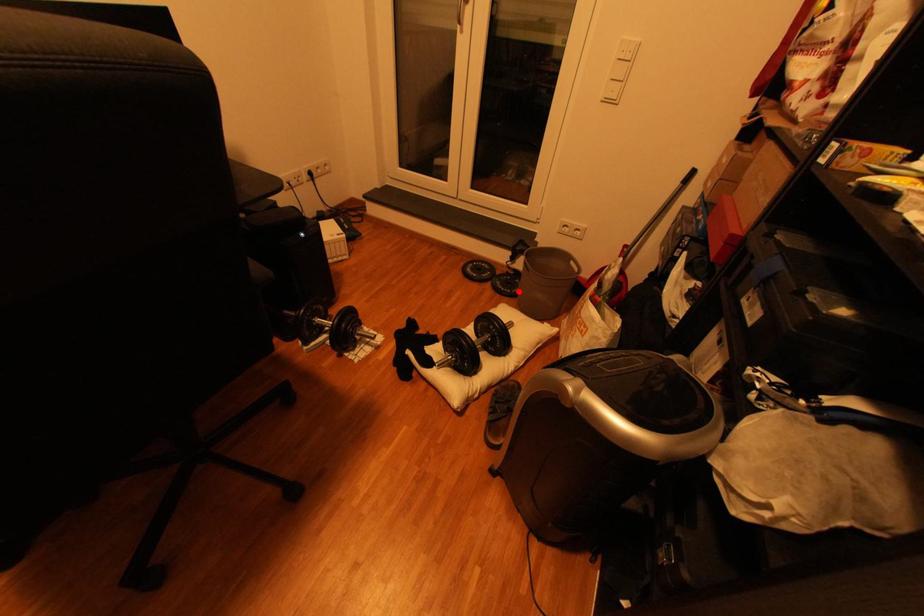
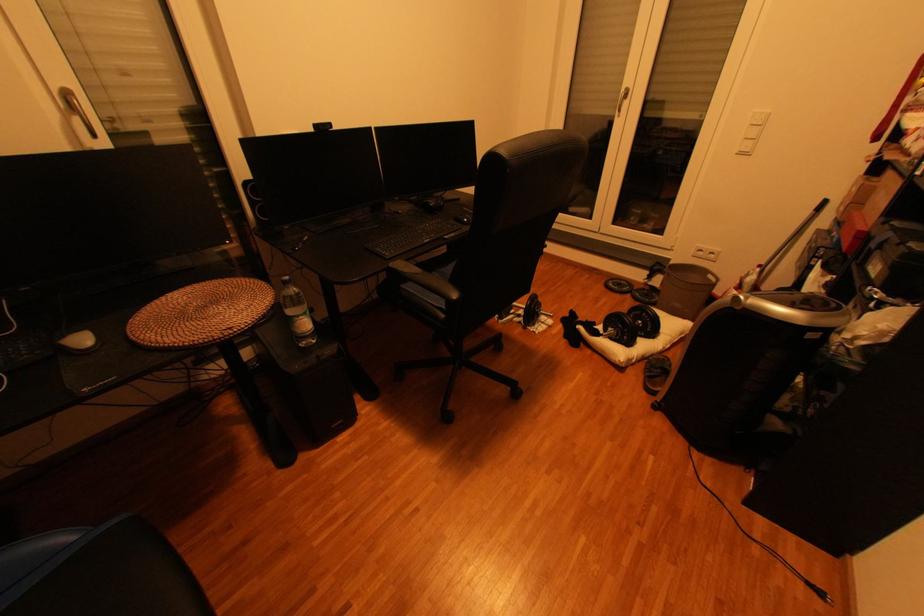
Question: I am providing you with two images of the same scene from different viewpoints. In image1, a red point is highlighted. Considering the same 3D point in image2, which of the following is correct?

Choices:
 (A) It is closer
 (B) It is farther

Answer: (B)